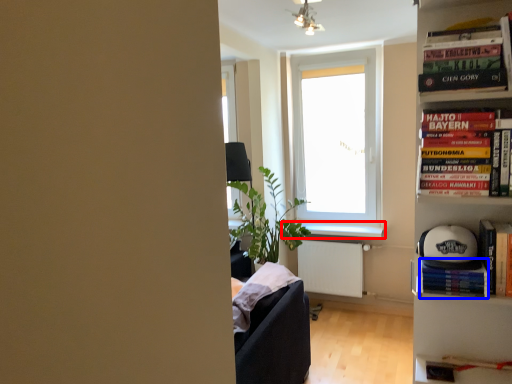
Question: Which object is further to the camera taking this photo, window sill (highlighted by a red box) or paperback book (highlighted by a blue box)?

Choices:
 (A) window sill
 (B) paperback book

Answer: (A)